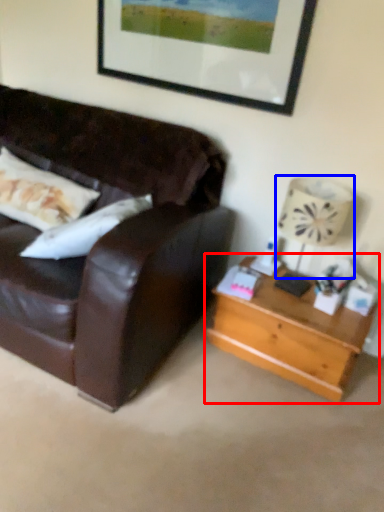
Question: Among these objects, which one is farthest to the camera, table (highlighted by a red box) or lamp (highlighted by a blue box)?

Choices:
 (A) table
 (B) lamp

Answer: (A)